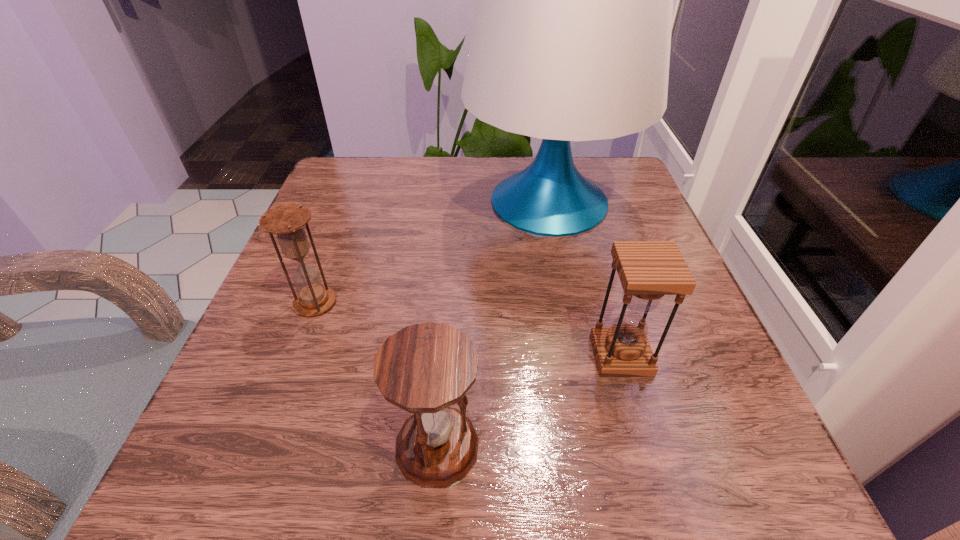
Where is `free spot that satisfies the following two spatial constraints: 1. on the front side of the second farthest object; 2. on the right side of the second hourglass from left to right`? This screenshot has height=540, width=960. free spot that satisfies the following two spatial constraints: 1. on the front side of the second farthest object; 2. on the right side of the second hourglass from left to right is located at coordinates (261, 446).

Where is `vacant region that satisfies the following two spatial constraints: 1. on the front-facing side of the farthest object; 2. on the back side of the second nearest hourglass`? The height and width of the screenshot is (540, 960). vacant region that satisfies the following two spatial constraints: 1. on the front-facing side of the farthest object; 2. on the back side of the second nearest hourglass is located at coordinates pos(580,355).